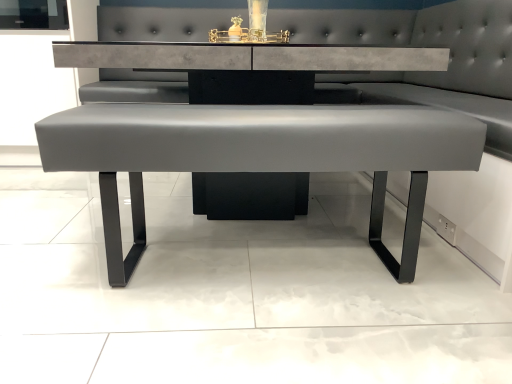
Question: Is satin gray bench at center, the second table positioned from the back, spatially inside satin gray leather bench at center, positioned as the 2th table in front-to-back order, or outside of it?

Choices:
 (A) inside
 (B) outside

Answer: (A)

Question: In terms of width, does satin gray bench at center, which is the 1th table from front to back, look wider or thinner when compared to satin gray leather bench at center, which ranks as the first table in back-to-front order?

Choices:
 (A) wide
 (B) thin

Answer: (B)

Question: Relative to satin gray leather bench at center, which ranks as the first table in back-to-front order, is satin gray bench at center, which is the 1th table from front to back, in front or behind?

Choices:
 (A) front
 (B) behind

Answer: (A)

Question: Based on their positions, is satin gray leather bench at center, which ranks as the first table in back-to-front order, located to the left or right of satin gray bench at center, the second table positioned from the back?

Choices:
 (A) right
 (B) left

Answer: (B)

Question: Looking at their shapes, would you say satin gray leather bench at center, positioned as the 2th table in front-to-back order, is wider or thinner than satin gray bench at center, which is the 1th table from front to back?

Choices:
 (A) wide
 (B) thin

Answer: (A)

Question: From the image's perspective, relative to satin gray bench at center, which is the 1th table from front to back, is satin gray leather bench at center, which ranks as the first table in back-to-front order, above or below?

Choices:
 (A) below
 (B) above

Answer: (B)

Question: Is point (140, 51) closer or farther from the camera than point (184, 135)?

Choices:
 (A) closer
 (B) farther

Answer: (B)